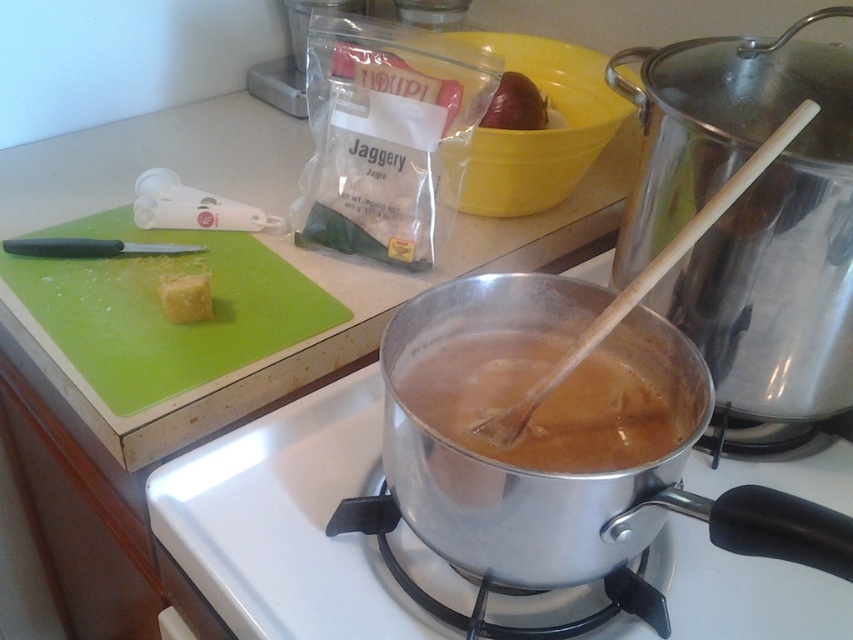
Does point (347, 595) come in front of point (610, 308)?

No.

Which is behind, point (283, 456) or point (670, 266)?

The point (283, 456) is behind.

Locate an element on the screen. The width and height of the screenshot is (853, 640). silver metallic pot at center is located at coordinates (282, 525).

Does wooden spoon at center have a smaller size compared to red glossy apple at upper center?

No, wooden spoon at center is not smaller than red glossy apple at upper center.

Is point (700, 232) more distant than point (518, 112)?

No, (700, 232) is closer to viewer.

Identify the location of wooden spoon at center. (646, 278).

Looking at this image, is green cutting board at left smaller than red glossy apple at upper center?

No, green cutting board at left is not smaller than red glossy apple at upper center.

Can you confirm if green cutting board at left is positioned below red glossy apple at upper center?

Correct, green cutting board at left is located below red glossy apple at upper center.

At what (x,y) coordinates should I click in order to perform the action: click on green cutting board at left. Please return your answer as a coordinate pair (x, y). Image resolution: width=853 pixels, height=640 pixels. Looking at the image, I should click on (161, 308).